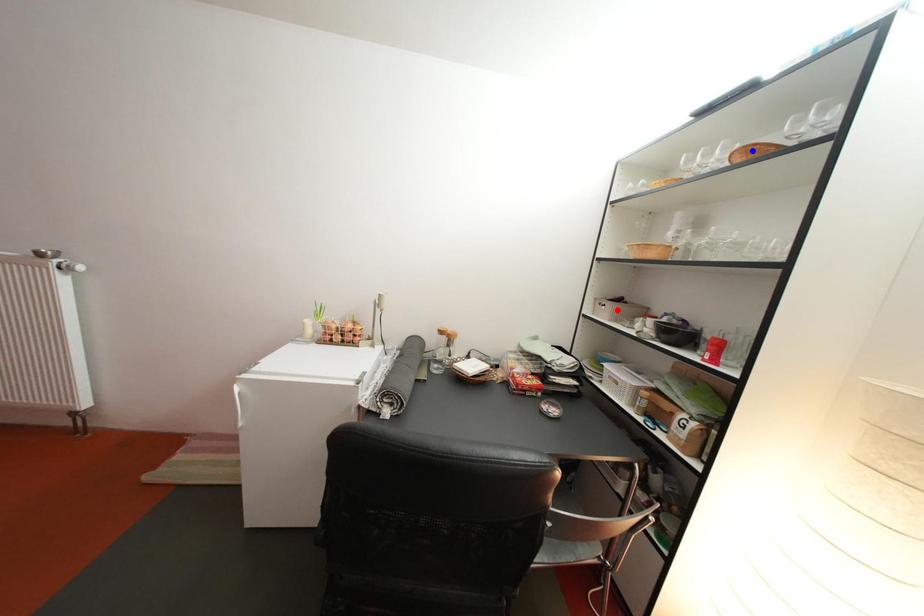
Question: Which of the two points in the image is closer to the camera?

Choices:
 (A) Blue point is closer.
 (B) Red point is closer.

Answer: (A)